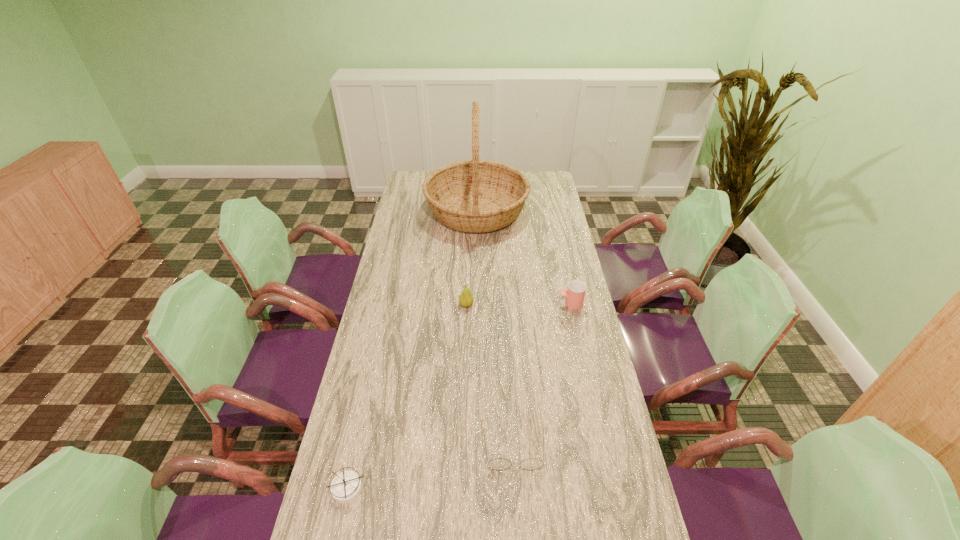
Identify the location of the farthest object. Image resolution: width=960 pixels, height=540 pixels. (475, 196).

This screenshot has width=960, height=540. I want to click on basket, so click(475, 196).

You are a GUI agent. You are given a task and a screenshot of the screen. Output one action in this format:
    pyautogui.click(x=<x>, y=<y>)
    Task: Click on the pear
    
    Given the screenshot: What is the action you would take?
    pyautogui.click(x=465, y=299)

Where is `the rightmost object`? the rightmost object is located at coordinates (575, 294).

Locate an element on the screen. The height and width of the screenshot is (540, 960). cup is located at coordinates (575, 294).

The image size is (960, 540). I want to click on the second shortest object, so click(499, 464).

Find the location of a particular element. The height and width of the screenshot is (540, 960). the leftmost object is located at coordinates (346, 486).

This screenshot has width=960, height=540. I want to click on compass, so click(x=346, y=486).

You are a GUI agent. You are given a task and a screenshot of the screen. Output one action in this format:
    pyautogui.click(x=<x>, y=<y>)
    Task: Click on the vacant space positioned 0.120m on the front of the tallest object
    This screenshot has width=960, height=540.
    Given the screenshot: What is the action you would take?
    pyautogui.click(x=476, y=260)

At what (x,y) coordinates should I click in order to perform the action: click on free space located 0.090m on the right of the pear. Please return your answer as a coordinate pair (x, y). This screenshot has height=540, width=960. Looking at the image, I should click on (497, 305).